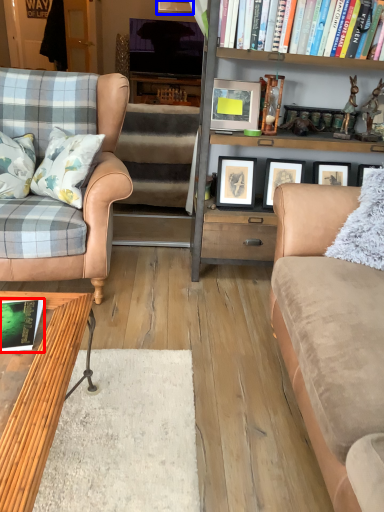
Question: Which of the following is the farthest to the observer, book (highlighted by a red box) or picture frame (highlighted by a blue box)?

Choices:
 (A) book
 (B) picture frame

Answer: (B)